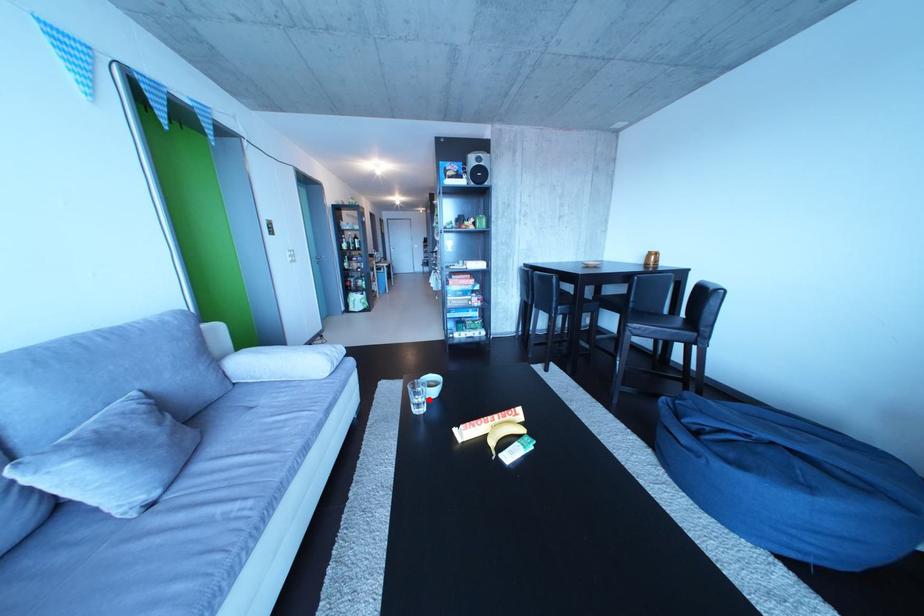
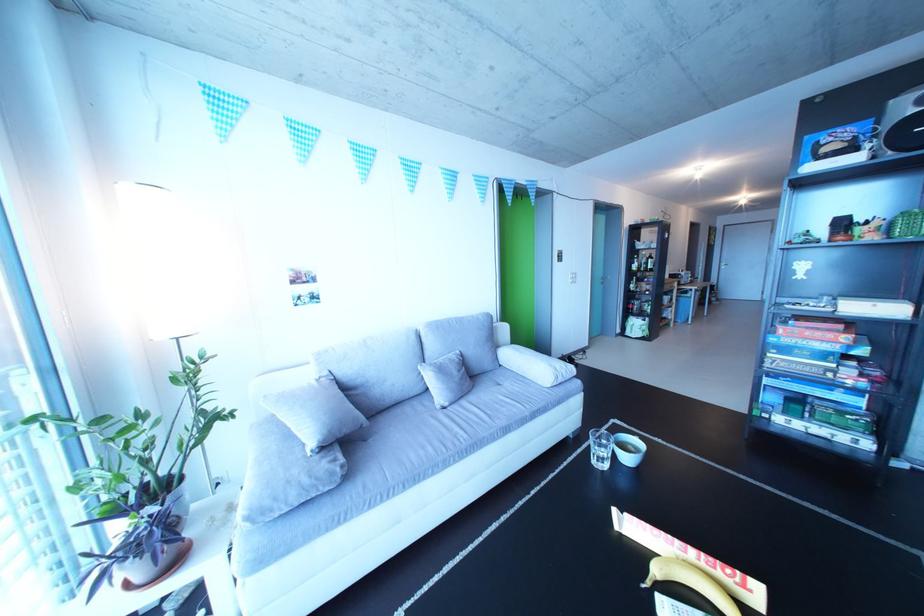
Question: I am providing you with two images of the same scene from different viewpoints. In image1, a red point is highlighted. Considering the same 3D point in image2, which of the following is correct?

Choices:
 (A) It is closer
 (B) It is farther

Answer: (A)